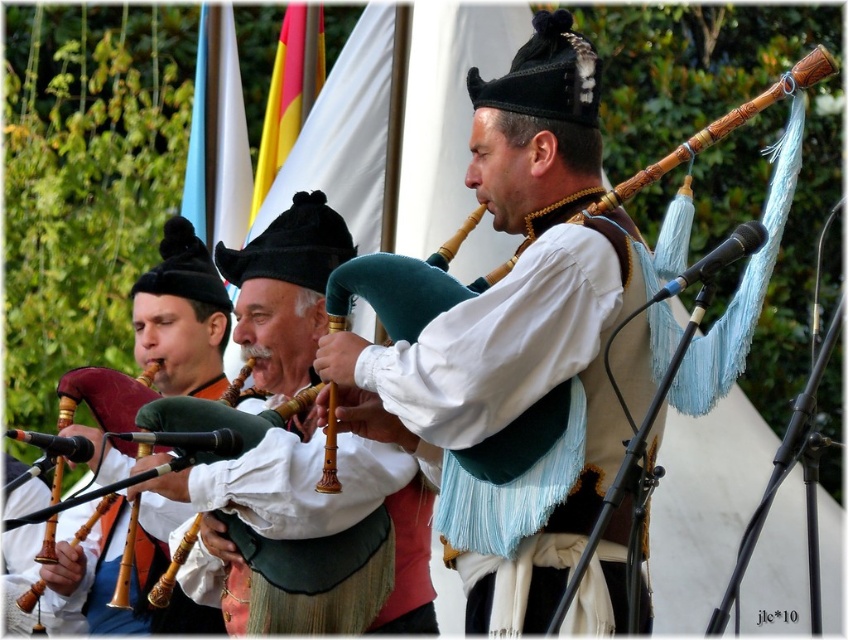
Question: Which of these objects is positioned farthest from the wooden pipes at left?

Choices:
 (A) wooden bagpipes at center
 (B) matte black bagpipe at left
 (C) matte brown bagpipes at center

Answer: (C)

Question: Is matte brown bagpipes at center positioned at the back of wooden pipes at left?

Choices:
 (A) no
 (B) yes

Answer: (A)

Question: Does wooden bagpipes at center come behind wooden pipes at left?

Choices:
 (A) yes
 (B) no

Answer: (B)

Question: Among these points, which one is nearest to the camera?

Choices:
 (A) (60, 460)
 (B) (455, 412)
 (C) (294, 465)

Answer: (B)

Question: Does matte brown bagpipes at center have a larger size compared to wooden bagpipes at center?

Choices:
 (A) no
 (B) yes

Answer: (B)

Question: Which of the following is the closest to the observer?

Choices:
 (A) (276, 292)
 (B) (616, 369)
 (C) (193, 294)
 (D) (36, 592)

Answer: (B)